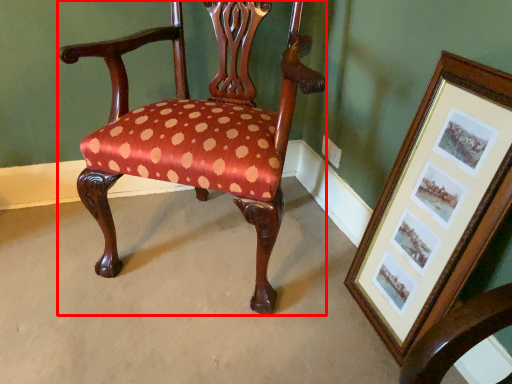
Question: In this image, where is chair (annotated by the red box) located relative to picture frame?

Choices:
 (A) left
 (B) right

Answer: (A)